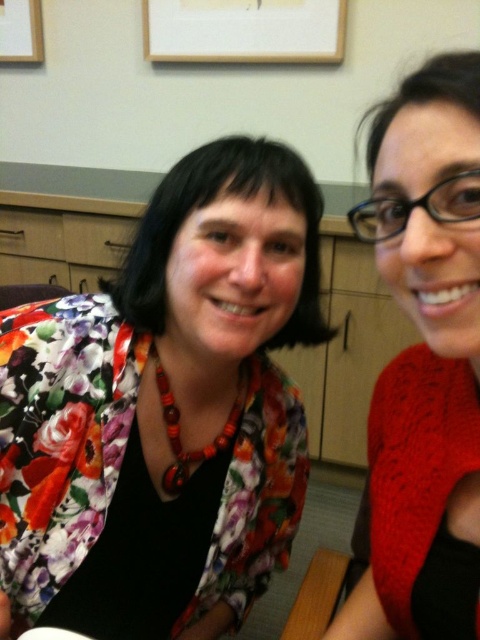
Consider the image. You are an interior designer planning to hang a new decorative item in this office scene. The new item must be placed above the floral fabric jacket at center but below the white matte picture frame at upper center. Is there enough vertical space between these two objects to accommodate the new item?

The floral fabric jacket at center is below the white matte picture frame at upper center, so there is vertical space between them. Therefore, the new decorative item can be placed between the two objects.

You are an interior designer assessing the office layout. You need to determine if the floral fabric jacket at center can be seen without obstruction from the white matte picture frame at upper center. Can you confirm this?

The floral fabric jacket at center is closer to the viewer than the white matte picture frame at upper center, so it would block the view of the frame from the front perspective.

You are an interior designer assessing the space. You need to determine if the floral fabric jacket at center can be hung on a standard coat hook that is designed to hold items up to the size of the white matte picture frame at upper center. Can it fit?

The floral fabric jacket at center is larger in size than the white matte picture frame at upper center, so it cannot fit on the standard coat hook designed for the frame.